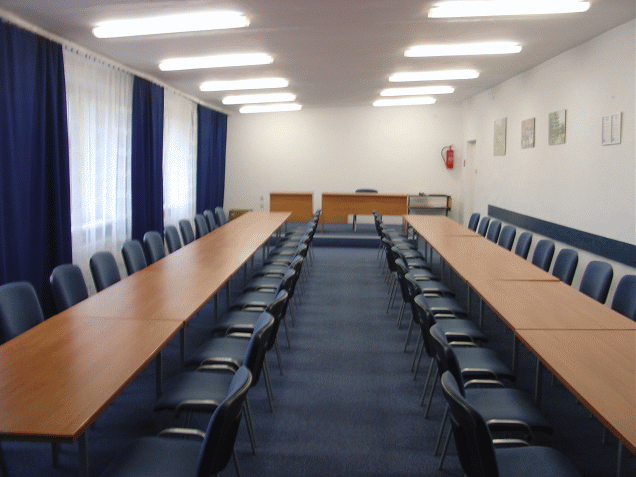
Where is `white walls`? The width and height of the screenshot is (636, 477). white walls is located at coordinates (275, 138), (574, 176).